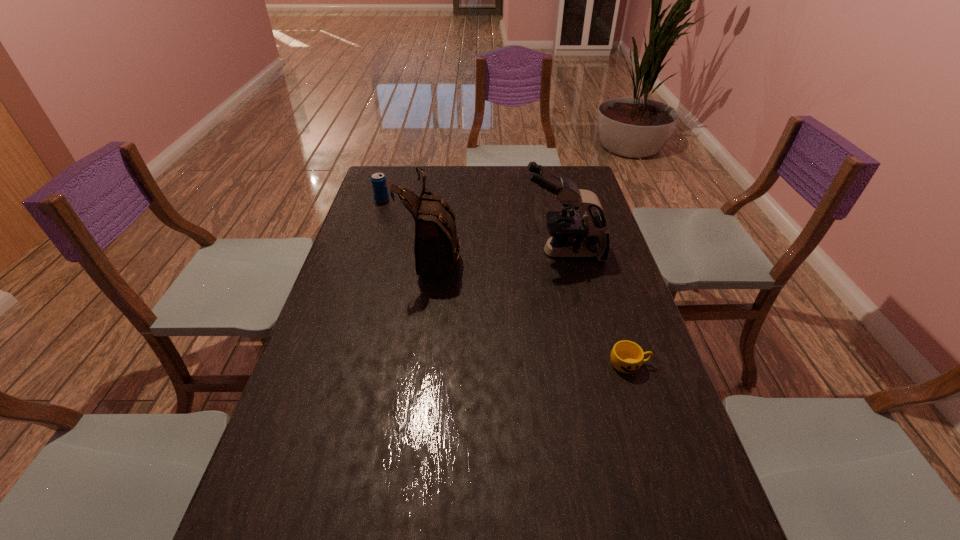
Locate an element on the screen. free space in the image that satisfies the following two spatial constraints: 1. through the eyepieces of the microscope; 2. on the back side of the shortest object is located at coordinates (589, 363).